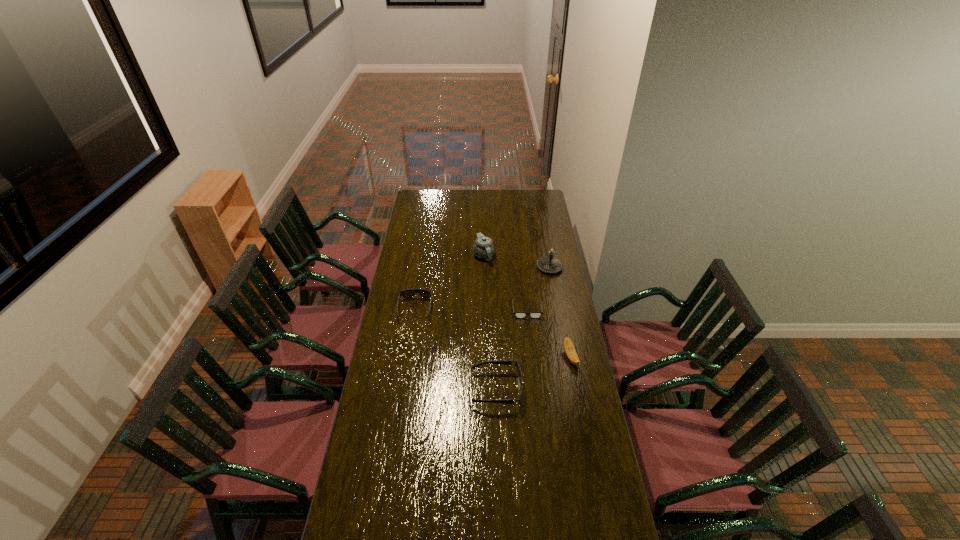
Identify the location of the shorter sunglasses. Image resolution: width=960 pixels, height=540 pixels. (409, 293).

Where is `the farther sunglasses`? the farther sunglasses is located at coordinates (409, 293).

Locate an element on the screen. the taller sunglasses is located at coordinates (503, 362).

This screenshot has height=540, width=960. I want to click on the nearer sunglasses, so click(x=503, y=362).

What are the coordinates of `chinaware` in the screenshot? It's located at (483, 248).

This screenshot has width=960, height=540. I want to click on banana, so click(569, 348).

What are the coordinates of `candle` in the screenshot? It's located at (550, 264).

Find the location of a particular element. The width and height of the screenshot is (960, 540). the shortest object is located at coordinates (517, 314).

Locate an element on the screen. blank space located on the front-facing side of the second shortest object is located at coordinates (411, 336).

Image resolution: width=960 pixels, height=540 pixels. Find the location of `blank space located 0.250m on the front-facing side of the taller sunglasses`. blank space located 0.250m on the front-facing side of the taller sunglasses is located at coordinates (412, 389).